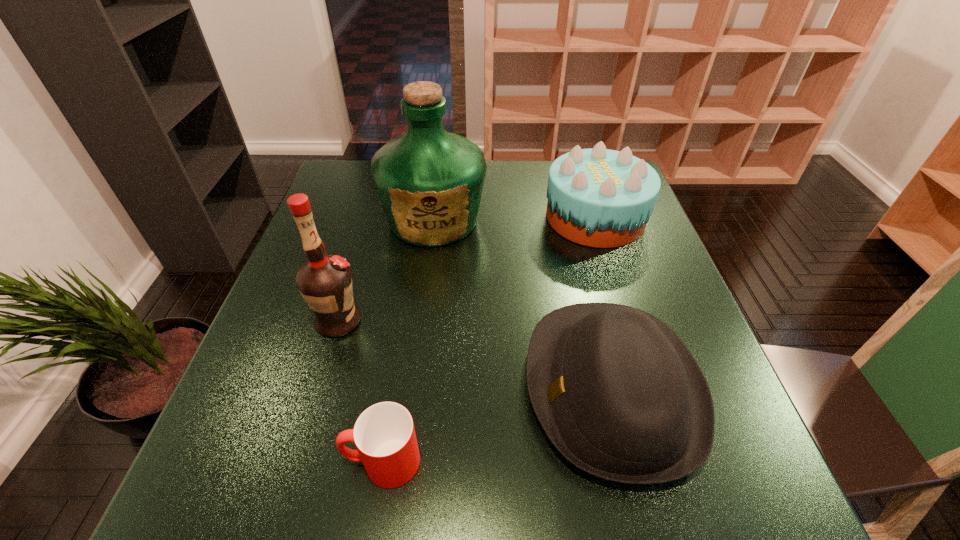
Identify the location of the farther liquor. This screenshot has width=960, height=540. (429, 181).

Locate an element on the screen. the nearer liquor is located at coordinates (324, 281).

This screenshot has height=540, width=960. I want to click on cake, so click(601, 198).

Locate an element on the screen. This screenshot has width=960, height=540. fedora is located at coordinates 618,393.

Where is `the shortest object`? This screenshot has width=960, height=540. the shortest object is located at coordinates (384, 434).

Where is `blank area located 0.080m on the label side of the farther liquor`? blank area located 0.080m on the label side of the farther liquor is located at coordinates (426, 276).

Locate an element on the screen. free space located 0.270m on the front and back of the nearer liquor is located at coordinates (488, 322).

Identify the location of blank space located 0.070m on the front of the cake. The height and width of the screenshot is (540, 960). (612, 269).

Find the location of `free spot located 0.350m on the front-facing side of the fedora`. free spot located 0.350m on the front-facing side of the fedora is located at coordinates (341, 388).

Where is `vacant space situated on the front-facing side of the fedora`? vacant space situated on the front-facing side of the fedora is located at coordinates (367, 388).